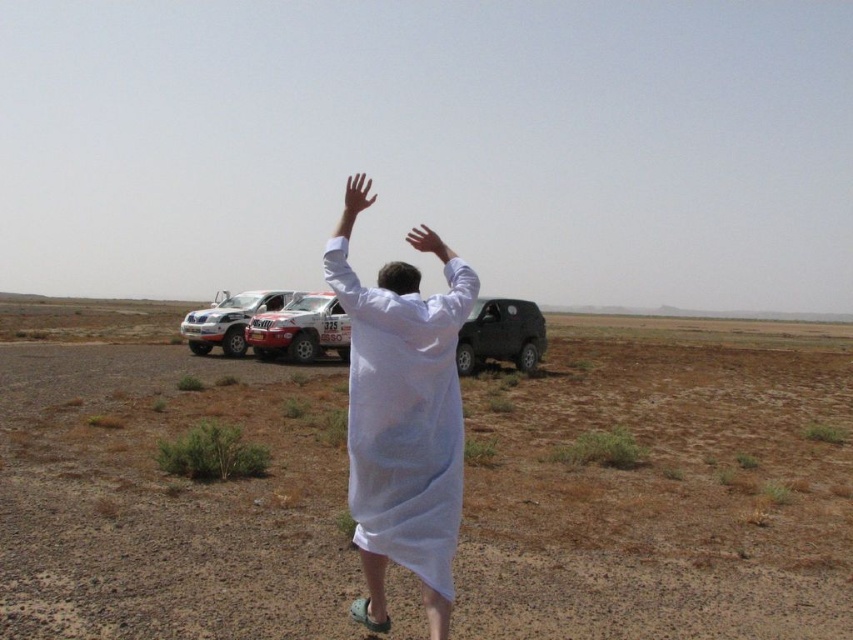
Does brown sandy dirt field at center have a greater width compared to matte black suv at center?

Correct, the width of brown sandy dirt field at center exceeds that of matte black suv at center.

Which is in front, point (20, 353) or point (483, 349)?

Positioned in front is point (483, 349).

Is point (142, 449) behind point (483, 298)?

That is False.

Where is `brown sandy dirt field at center`? Image resolution: width=853 pixels, height=640 pixels. brown sandy dirt field at center is located at coordinates (662, 484).

Is white cloth at center wider than white matte hand at upper center?

In fact, white cloth at center might be narrower than white matte hand at upper center.

Which of these two, white cloth at center or white matte hand at upper center, stands taller?

white matte hand at upper center

Identify the location of white cloth at center. This screenshot has height=640, width=853. (403, 426).

Find the location of `white cloth at center`. white cloth at center is located at coordinates (403, 426).

Does point (451, 465) come farther from viewer compared to point (439, 250)?

No, (451, 465) is closer to viewer.

What do you see at coordinates (403, 426) in the screenshot?
I see `white cloth at center` at bounding box center [403, 426].

Identify the location of white cloth at center. (403, 426).